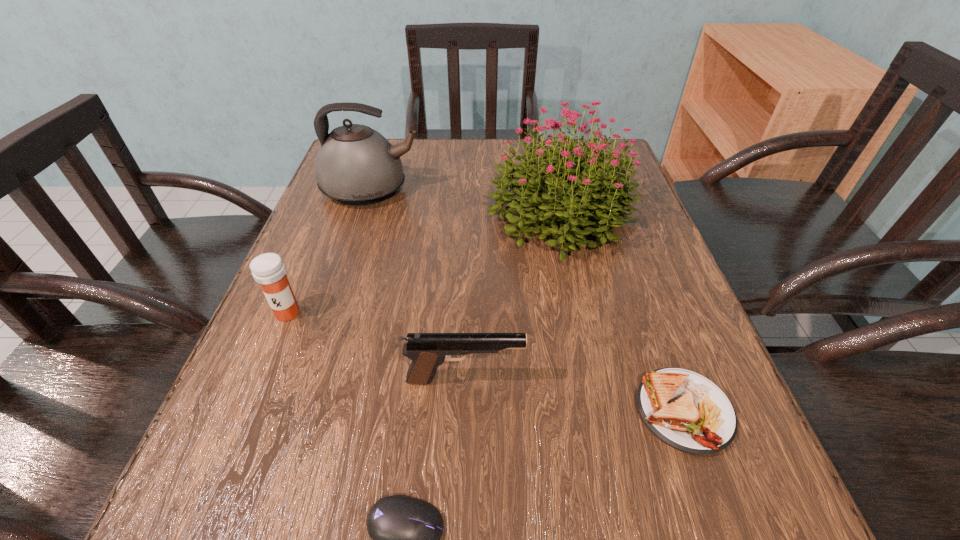
Identify which object is the closest to the third farthest object. Please provide its 2D coordinates. Your answer should be formatted as a tuple, i.e. [(x, y)], where the tuple contains the x and y coordinates of a point satisfying the conditions above.

[(427, 351)]

Find the location of a particular element. The width and height of the screenshot is (960, 540). the third closest object to the pistol is located at coordinates (268, 269).

You are a GUI agent. You are given a task and a screenshot of the screen. Output one action in this format:
    pyautogui.click(x=<x>, y=<y>)
    Task: Click on the free region that satisfies the following two spatial constraints: 1. at the muzzle of the sandwich; 2. on the left side of the pistol
    
    Given the screenshot: What is the action you would take?
    pyautogui.click(x=464, y=411)

Identify the location of vacant space that satisfies the following two spatial constraints: 1. at the spout of the second tallest object; 2. on the label side of the medicine. This screenshot has height=540, width=960. (333, 313).

I want to click on vacant region that satisfies the following two spatial constraints: 1. on the label side of the medicine; 2. on the left side of the fifth tallest object, so click(x=247, y=411).

At what (x,y) coordinates should I click in order to perform the action: click on free point that satisfies the following two spatial constraints: 1. on the front side of the tallest object; 2. on the right side of the fifth tallest object. Please return your answer as a coordinate pair (x, y). Looking at the image, I should click on (604, 411).